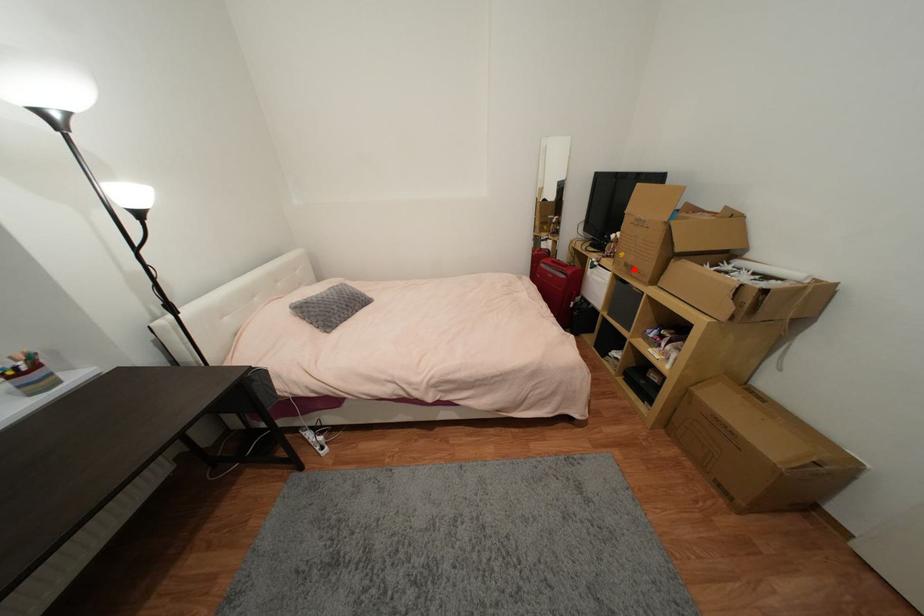
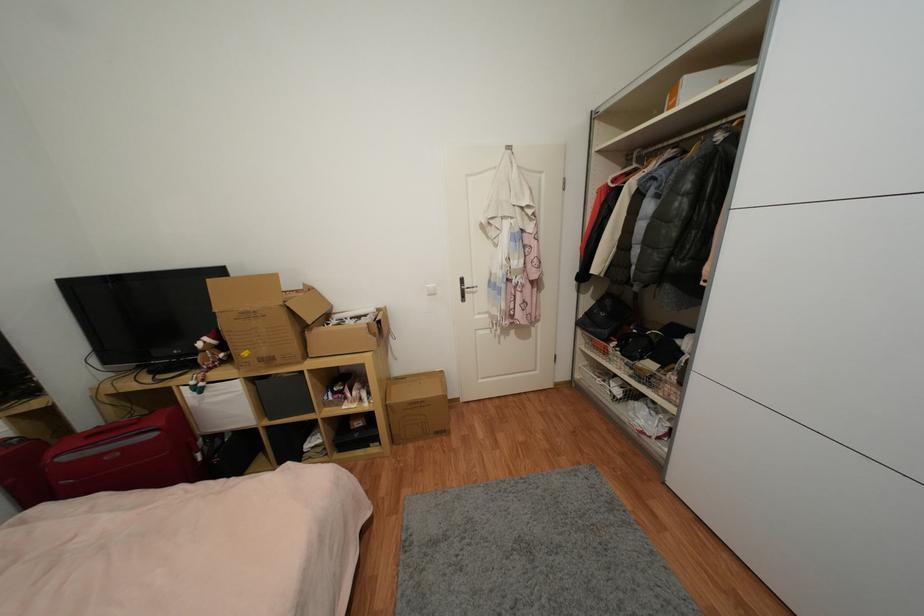
The point at the highlighted location is marked in the first image. Where is the corresponding point in the second image?

(274, 361)